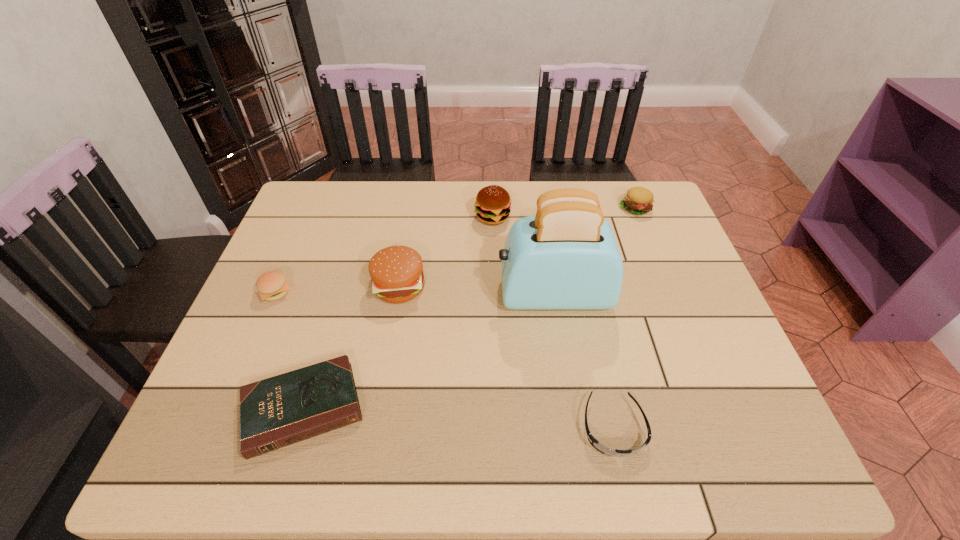
Find the location of `vacant space in between the sunglasses and the third hamburger from left to right`. vacant space in between the sunglasses and the third hamburger from left to right is located at coordinates (553, 322).

At what (x,y) coordinates should I click in order to perform the action: click on free space that is in between the rightmost object and the sunglasses. Please return your answer as a coordinate pair (x, y). This screenshot has height=540, width=960. Looking at the image, I should click on (624, 318).

This screenshot has height=540, width=960. In order to click on vacant area that lies between the leftmost hamburger and the second hamburger from left to right in this screenshot , I will do `click(338, 289)`.

This screenshot has height=540, width=960. Identify the location of free space between the second hamburger from left to right and the Bible. point(351,347).

This screenshot has width=960, height=540. Identify the location of empty space between the sunglasses and the second hamburger from right to left. (553, 322).

Find the location of a particular element. vacant area that lies between the leftmost hamburger and the Bible is located at coordinates (289, 350).

Where is `the sixth closest object to the tallest object`? The image size is (960, 540). the sixth closest object to the tallest object is located at coordinates (272, 285).

Identify the location of object that ranks as the fifth closest to the leftmost hamburger. Image resolution: width=960 pixels, height=540 pixels. (594, 442).

This screenshot has height=540, width=960. Identify the location of hamburger that stands as the second closest to the third hamburger from right to left. (493, 203).

The height and width of the screenshot is (540, 960). What are the coordinates of `hamburger identified as the second closest to the sunglasses` in the screenshot? It's located at (493, 203).